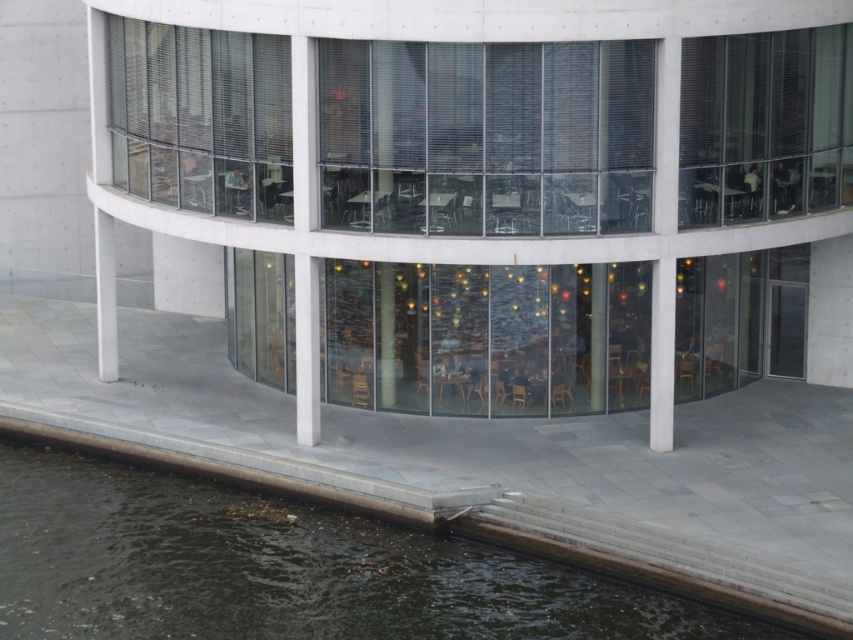
Which is more to the left, dark water at lower left or transparent glass pillar at center?

dark water at lower left

Is point (503, 534) more distant than point (390, 404)?

No, (503, 534) is in front of (390, 404).

You are a GUI agent. You are given a task and a screenshot of the screen. Output one action in this format:
    pyautogui.click(x=<x>, y=<y>)
    Task: Click on the dark water at lower left
    This screenshot has width=853, height=640.
    Given the screenshot: What is the action you would take?
    pyautogui.click(x=486, y=531)

Identify the location of dark water at lower left. point(486,531).

Can you confirm if transparent glass window at upper right is positioned to the right of white concrete pillar at lower left?

Indeed, transparent glass window at upper right is positioned on the right side of white concrete pillar at lower left.

Does point (821, 60) lie behind point (108, 372)?

No, (821, 60) is in front of (108, 372).

This screenshot has width=853, height=640. In order to click on transparent glass window at upper right in this screenshot , I will do `click(764, 125)`.

Who is positioned more to the right, white concrete pillar at lower left or transparent glass pillar at center?

transparent glass pillar at center

Does white concrete pillar at lower left have a larger size compared to transparent glass pillar at center?

Incorrect, white concrete pillar at lower left is not larger than transparent glass pillar at center.

Between point (99, 225) and point (392, 396), which one is positioned behind?

Positioned behind is point (99, 225).

Where is `white concrete pillar at lower left`? The image size is (853, 640). white concrete pillar at lower left is located at coordinates (105, 296).